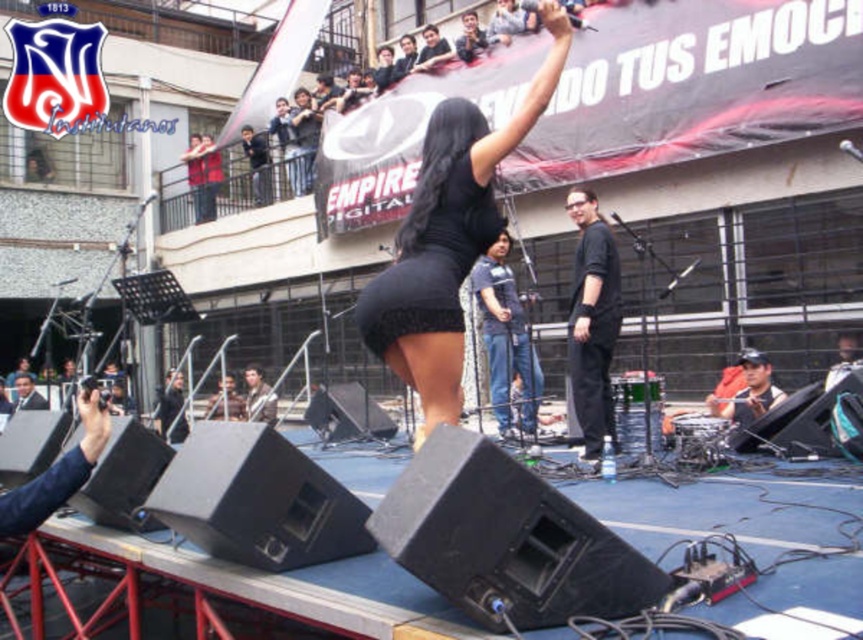
Question: Which object is farther from the camera taking this photo?

Choices:
 (A) black matte skirt at center
 (B) black matte pants at center
 (C) black lace dress at center

Answer: (B)

Question: Can you confirm if black matte skirt at center is positioned below black matte shorts at center?

Choices:
 (A) yes
 (B) no

Answer: (B)

Question: Is black lace dress at center below black matte shorts at center?

Choices:
 (A) no
 (B) yes

Answer: (A)

Question: Which object appears closest to the camera in this image?

Choices:
 (A) dark blue baseball cap at lower right
 (B) black lace dress at center

Answer: (B)

Question: Is black matte skirt at center to the right of black lace dress at center from the viewer's perspective?

Choices:
 (A) no
 (B) yes

Answer: (B)

Question: Which of the following is the closest to the observer?

Choices:
 (A) black matte shorts at center
 (B) black lace dress at center
 (C) black matte pants at center
 (D) black matte skirt at center

Answer: (D)